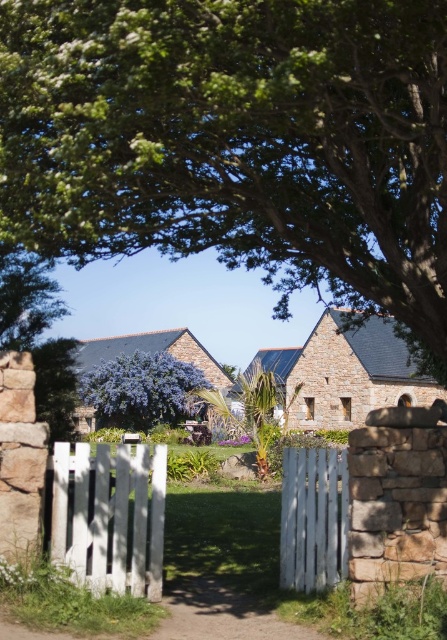
Does green leafy tree at upper left have a smaller size compared to green leafy palm at center?

Yes, green leafy tree at upper left is smaller than green leafy palm at center.

Does green leafy tree at upper left appear under green leafy palm at center?

No.

Which is behind, point (1, 276) or point (282, 396)?

The point (282, 396) is more distant.

Where is `green leafy tree at upper left`? This screenshot has height=640, width=447. green leafy tree at upper left is located at coordinates (25, 298).

Is white wooden fence at center smaller than green leafy tree at upper left?

Correct, white wooden fence at center occupies less space than green leafy tree at upper left.

Does point (303, 515) come closer to viewer compared to point (26, 280)?

Yes, point (303, 515) is in front of point (26, 280).

Identify the location of white wooden fence at center. The image size is (447, 640). (313, 518).

Does green leafy tree at upper center appear on the left side of green leafy palm at center?

No, green leafy tree at upper center is not to the left of green leafy palm at center.

Does point (421, 307) come in front of point (260, 417)?

Yes, it is.

The image size is (447, 640). Find the location of `green leafy tree at upper center`. green leafy tree at upper center is located at coordinates (237, 141).